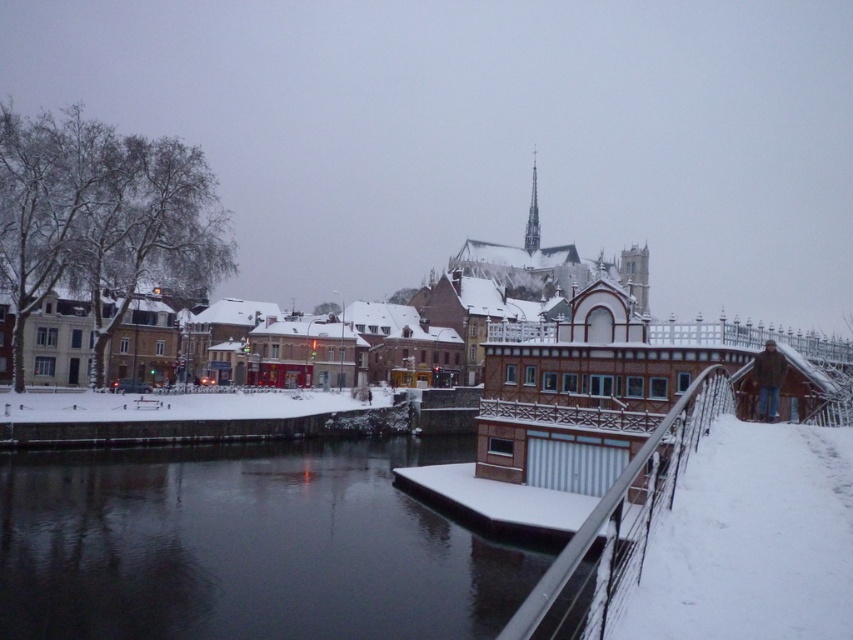
Consider the image. Can you confirm if black water at center is taller than metallic silver rail at right?

In fact, black water at center may be shorter than metallic silver rail at right.

Who is more distant from viewer, (135, 461) or (640, 552)?

Point (135, 461)

This screenshot has height=640, width=853. In order to click on black water at center in this screenshot , I will do `click(247, 547)`.

Does metallic silver rail at right appear under smooth stone spire at upper center?

Yes, metallic silver rail at right is below smooth stone spire at upper center.

Who is more distant from viewer, (607, 508) or (532, 170)?

The point (532, 170) is behind.

Identify the location of metallic silver rail at right. (619, 522).

The image size is (853, 640). Find the location of `metallic silver rail at right`. metallic silver rail at right is located at coordinates (619, 522).

Is point (44, 566) positioned after point (532, 246)?

No, (44, 566) is closer to viewer.

In order to click on black water at center in this screenshot , I will do `click(247, 547)`.